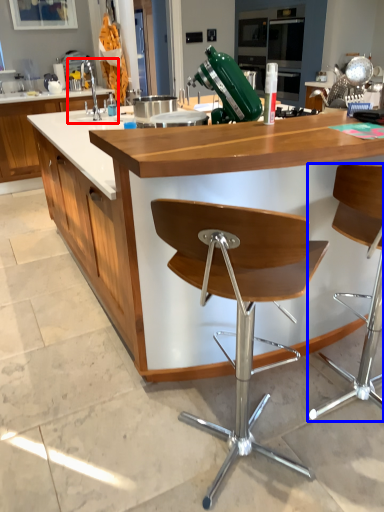
Question: Which of the following is the closest to the observer, sink (highlighted by a red box) or chair (highlighted by a blue box)?

Choices:
 (A) sink
 (B) chair

Answer: (B)